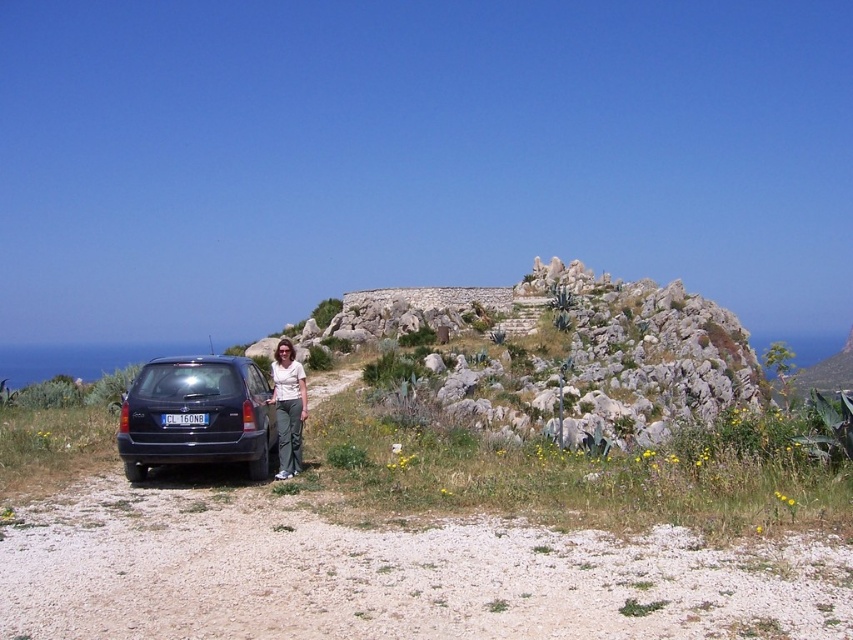
Between rocky stone hillside at center and shiny dark blue suv at center, which one is positioned higher?

rocky stone hillside at center is above.

Between rocky stone hillside at center and shiny dark blue suv at center, which one is positioned lower?

shiny dark blue suv at center is below.

Which is behind, point (309, 346) or point (126, 458)?

Positioned behind is point (309, 346).

Find the location of a particular element. rocky stone hillside at center is located at coordinates (639, 349).

Which is above, rocky stone hillside at center or matte white shirt at center?

rocky stone hillside at center is above.

Is rocky stone hillside at center shorter than matte white shirt at center?

No, rocky stone hillside at center is not shorter than matte white shirt at center.

This screenshot has height=640, width=853. Find the location of `rocky stone hillside at center`. rocky stone hillside at center is located at coordinates (639, 349).

The height and width of the screenshot is (640, 853). What do you see at coordinates (196, 412) in the screenshot? I see `shiny dark blue suv at center` at bounding box center [196, 412].

Between point (177, 442) and point (167, 424), which one is positioned in front?

Point (177, 442) is more forward.

The width and height of the screenshot is (853, 640). Find the location of `shiny dark blue suv at center`. shiny dark blue suv at center is located at coordinates (196, 412).